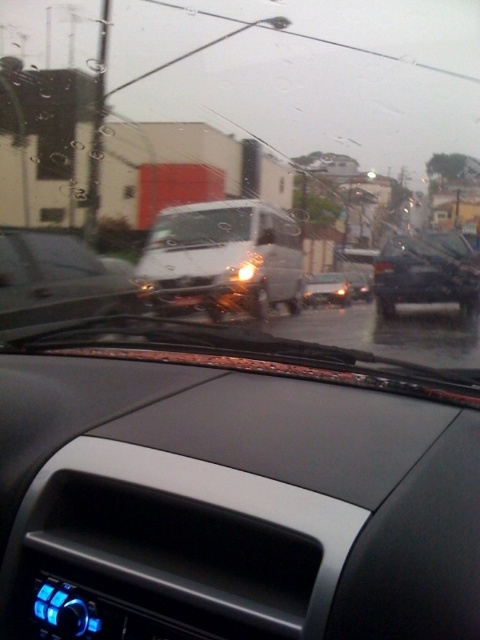
You are a passenger in the car and want to know if the point at coordinates (236, 168) is on the windshield. Can you confirm this?

Yes, the point at coordinates (236, 168) is on the transparent glass windshield at center.

You are a passenger in the car and looking out the windshield. You see a black matte car at right and a glossy white van at center. Which one is positioned higher in the image?

The black matte car at right is positioned higher in the image than the glossy white van at center.

You are a passenger in the car and looking out the window. You notice the transparent glass windshield at center and the black matte car at right. Which object is closer to the left side of your view?

The transparent glass windshield at center is closer to the left side of your view because it is positioned to the left of the black matte car at right.